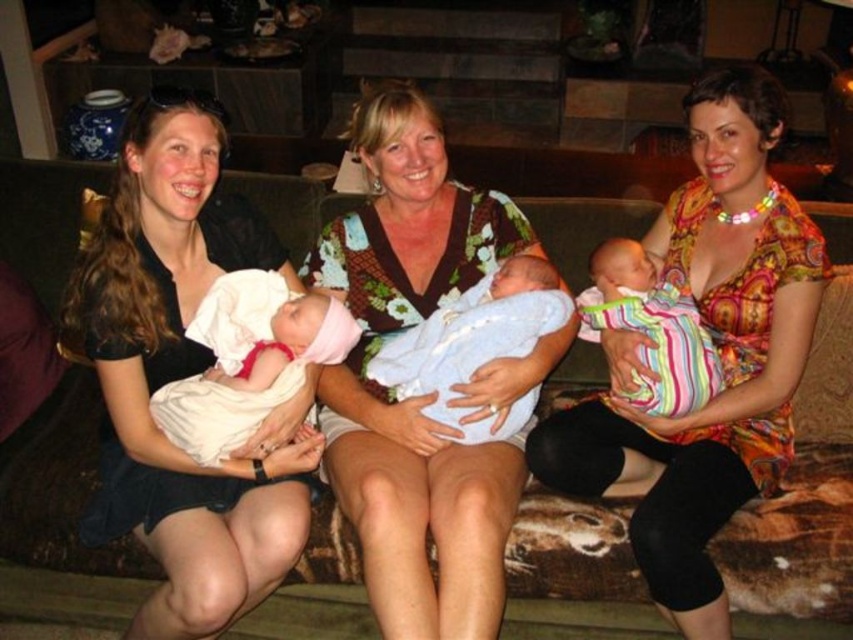
You are a photographer taking a portrait of the two babies. You need to ensure that both babies are visible in the frame. Given that the white clothed baby at center is taller than the light blue fabric swaddle at center, which baby should you position closer to the camera to maintain balance in the composition?

The white clothed baby at center is taller than the light blue fabric swaddle at center, so positioning the light blue fabric swaddle at center closer to the camera will help balance their sizes in the composition.